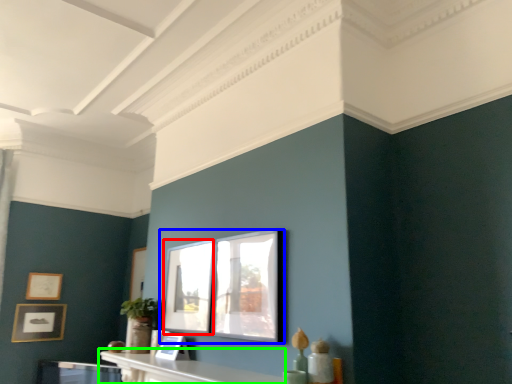
Question: Based on their relative distances, which object is farther from window (highlighted by a red box)? Choose from picture frame (highlighted by a blue box) and table (highlighted by a green box).

Choices:
 (A) picture frame
 (B) table

Answer: (B)